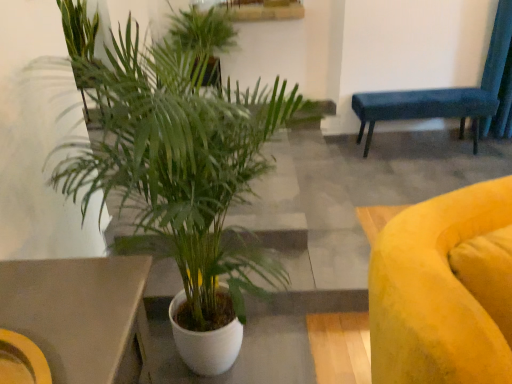
Question: From a real-world perspective, is white ceramic plant at center, positioned as the first houseplant in bottom-to-top order, on top of velvet blue bench at upper right?

Choices:
 (A) no
 (B) yes

Answer: (B)

Question: Is white ceramic plant at center, acting as the 2th houseplant starting from the top, aimed at velvet blue bench at upper right?

Choices:
 (A) yes
 (B) no

Answer: (B)

Question: Is white ceramic plant at center, placed as the 1th houseplant when sorted from front to back, completely or partially outside of velvet blue bench at upper right?

Choices:
 (A) yes
 (B) no

Answer: (A)

Question: From the image's perspective, does white ceramic plant at center, the second houseplant from the back, appear higher than velvet blue bench at upper right?

Choices:
 (A) no
 (B) yes

Answer: (A)

Question: Is velvet blue bench at upper right located within white ceramic plant at center, placed as the 1th houseplant when sorted from front to back?

Choices:
 (A) yes
 (B) no

Answer: (B)

Question: Can you confirm if white ceramic plant at center, the second houseplant from the back, is smaller than velvet blue bench at upper right?

Choices:
 (A) yes
 (B) no

Answer: (B)

Question: Is velvet blue bench at upper right further to the viewer compared to green leafy plant at upper center, arranged as the second houseplant when viewed from the front?

Choices:
 (A) no
 (B) yes

Answer: (B)

Question: Is velvet blue bench at upper right positioned with its back to green leafy plant at upper center, arranged as the second houseplant when viewed from the front?

Choices:
 (A) no
 (B) yes

Answer: (A)

Question: Considering the relative sizes of velvet blue bench at upper right and green leafy plant at upper center, the second houseplant positioned from the bottom, in the image provided, is velvet blue bench at upper right wider than green leafy plant at upper center, the second houseplant positioned from the bottom,?

Choices:
 (A) yes
 (B) no

Answer: (B)

Question: Can you confirm if velvet blue bench at upper right is positioned to the left of green leafy plant at upper center, which is the 1th houseplant from top to bottom?

Choices:
 (A) yes
 (B) no

Answer: (B)

Question: Is velvet blue bench at upper right shorter than green leafy plant at upper center, the second houseplant positioned from the bottom?

Choices:
 (A) no
 (B) yes

Answer: (B)

Question: Does velvet blue bench at upper right have a lesser width compared to green leafy plant at upper center, which is the 1th houseplant from top to bottom?

Choices:
 (A) no
 (B) yes

Answer: (B)

Question: Does velvet blue bench at upper right have a lesser width compared to white ceramic plant at center, positioned as the first houseplant in bottom-to-top order?

Choices:
 (A) no
 (B) yes

Answer: (B)